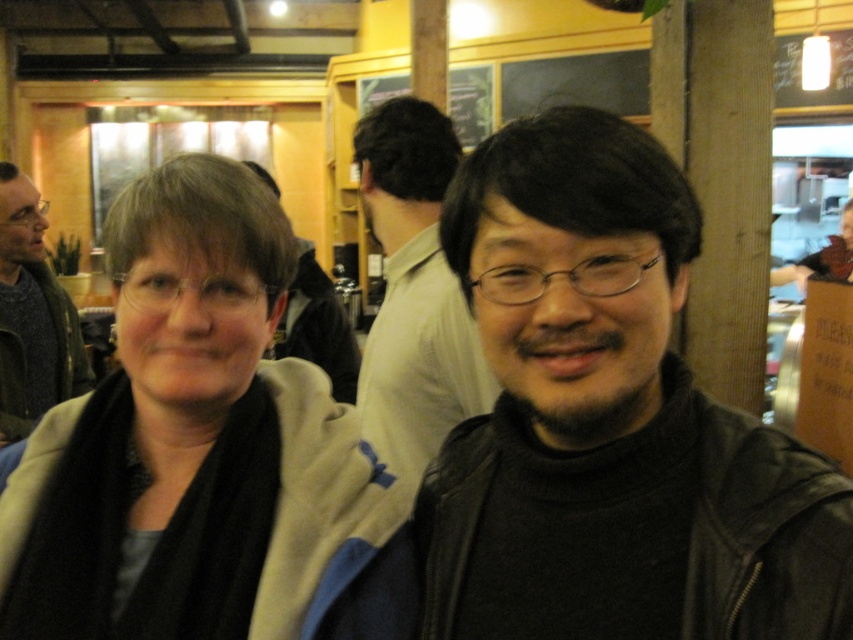
Is black matte jacket at center bigger than matte black jacket at center?

No, black matte jacket at center is not bigger than matte black jacket at center.

How far apart are black matte jacket at center and matte black jacket at center?

black matte jacket at center is 23.39 inches away from matte black jacket at center.

At what (x,y) coordinates should I click in order to perform the action: click on black matte jacket at center. Please return your answer as a coordinate pair (x, y). This screenshot has height=640, width=853. Looking at the image, I should click on (415, 291).

Does beige fabric jacket at center have a larger size compared to black matte jacket at center?

Incorrect, beige fabric jacket at center is not larger than black matte jacket at center.

Between point (311, 477) and point (380, 138), which one is positioned in front?

Positioned in front is point (311, 477).

Identify the location of beige fabric jacket at center. (201, 451).

Can you confirm if beige fabric jacket at center is positioned to the left of matte black jacket at center?

No, beige fabric jacket at center is not to the left of matte black jacket at center.

Measure the distance from beige fabric jacket at center to matte black jacket at center.

beige fabric jacket at center and matte black jacket at center are 4.62 feet apart.

Does point (114, 605) come behind point (332, 308)?

That is False.

I want to click on beige fabric jacket at center, so click(201, 451).